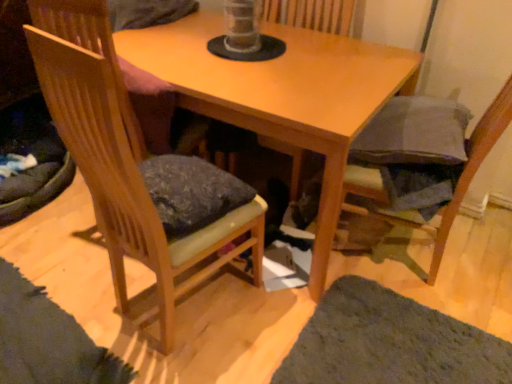
Where is `vacant area that is in front of wooden chair at left, which appears as the 2th chair when viewed from the right`? vacant area that is in front of wooden chair at left, which appears as the 2th chair when viewed from the right is located at coordinates (191, 361).